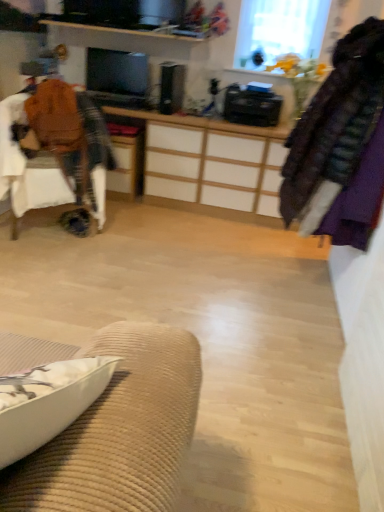
Question: In terms of width, does white fabric cushion at lower left look wider or thinner when compared to velvet purple coat at right?

Choices:
 (A) wide
 (B) thin

Answer: (B)

Question: From a real-world perspective, is white fabric cushion at lower left above or below velvet purple coat at right?

Choices:
 (A) above
 (B) below

Answer: (B)

Question: Which object is positioned closest to the matte black monitor at center?

Choices:
 (A) white fabric cushion at lower left
 (B) wooden desk at center
 (C) velvet purple coat at right
 (D) brown fabric chair at left
 (E) transparent glass window at upper center

Answer: (B)

Question: Considering the real-world distances, which object is farthest from the matte black monitor at center?

Choices:
 (A) transparent glass window at upper center
 (B) velvet purple coat at right
 (C) brown fabric chair at left
 (D) white fabric cushion at lower left
 (E) wooden desk at center

Answer: (D)